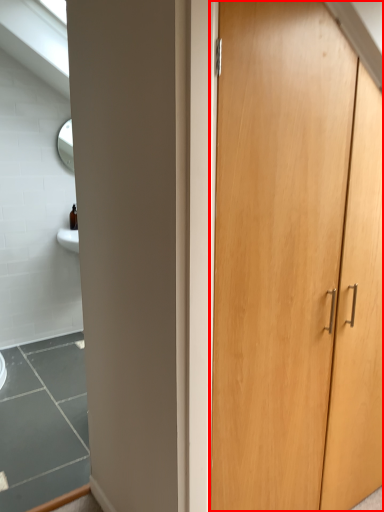
Question: Observing the image, what is the correct spatial positioning of cupboard (annotated by the red box) in reference to window?

Choices:
 (A) left
 (B) right

Answer: (B)